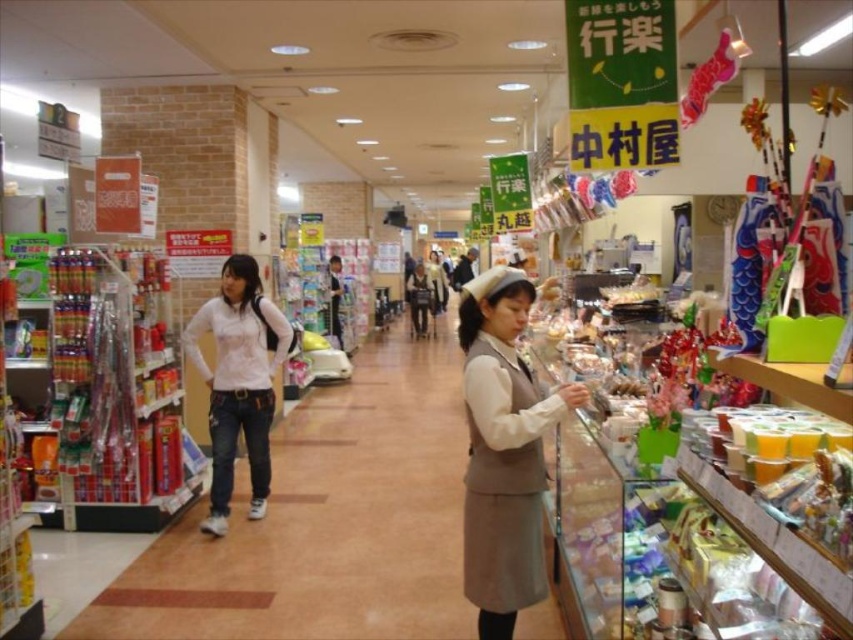
You are a store employee who needs to place the beige woolen dress at center and the white matte shirt at center onto a display rack. Which item should you place first if you want to arrange them from smallest to largest?

The beige woolen dress at center should be placed first because it is smaller than the white matte shirt at center.